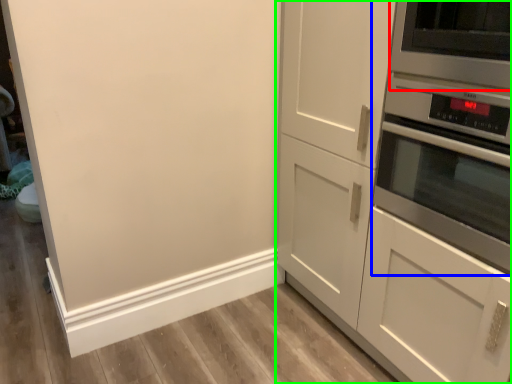
Question: Which object is positioned farthest from appliance (highlighted by a red box)? Select from home appliance (highlighted by a blue box) and cabinetry (highlighted by a green box).

Choices:
 (A) home appliance
 (B) cabinetry

Answer: (B)